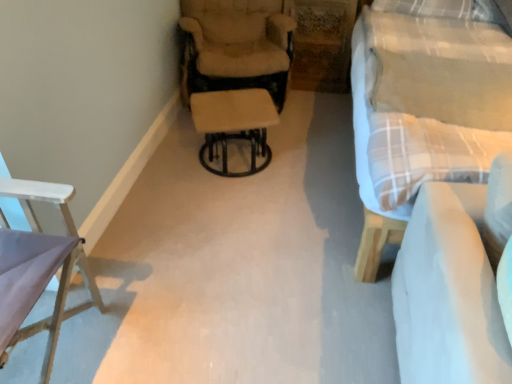
Question: In terms of width, does plaid fabric studio couch at right look wider or thinner when compared to white fabric couch at lower right?

Choices:
 (A) thin
 (B) wide

Answer: (B)

Question: Would you say plaid fabric studio couch at right is inside or outside white fabric couch at lower right?

Choices:
 (A) outside
 (B) inside

Answer: (A)

Question: Estimate the real-world distances between objects in this image. Which object is farther from the white wood chair at left, acting as the 1th chair starting from the front?

Choices:
 (A) beige fabric chair at center, the first chair from the right
 (B) black metal stool at center
 (C) plaid fabric studio couch at right
 (D) white fabric couch at lower right

Answer: (C)

Question: Which is farther from the plaid fabric studio couch at right?

Choices:
 (A) beige fabric chair at center, arranged as the 1th chair when viewed from the top
 (B) black metal stool at center
 (C) white wood chair at left, which appears as the second chair when viewed from the top
 (D) white fabric couch at lower right

Answer: (C)